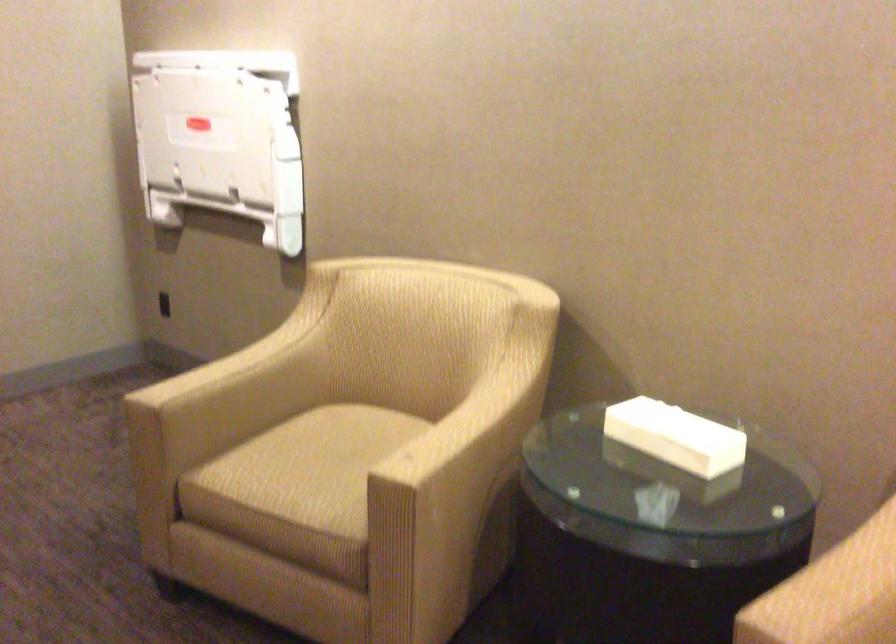
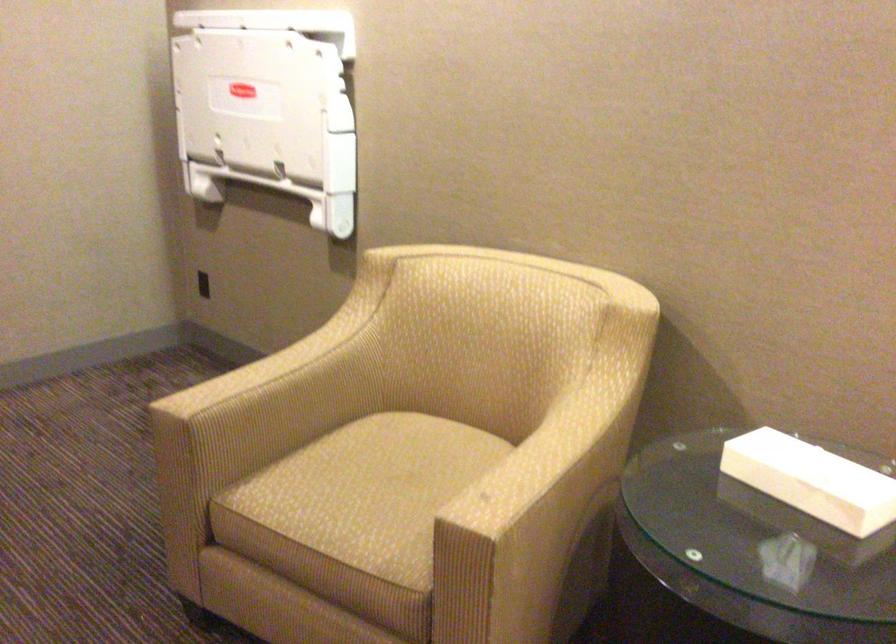
In the second image, find the point that corresponds to pixel 246 348 in the first image.

(289, 346)